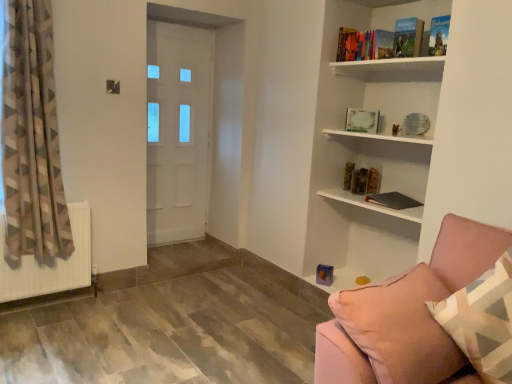
Question: Does hardcover book at upper right, the first book when ordered from bottom to top, have a larger size compared to hardcover book at upper right, which appears as the fifth book when ordered from the bottom?

Choices:
 (A) yes
 (B) no

Answer: (A)

Question: Does hardcover book at upper right, the first book when ordered from bottom to top, have a lesser height compared to hardcover book at upper right, which appears as the fifth book when ordered from the bottom?

Choices:
 (A) yes
 (B) no

Answer: (A)

Question: From the image's perspective, is hardcover book at upper right, the sixth book positioned from the top, located above hardcover book at upper right, which appears as the fifth book when ordered from the bottom?

Choices:
 (A) yes
 (B) no

Answer: (B)

Question: From a real-world perspective, is hardcover book at upper right, the first book when ordered from bottom to top, beneath hardcover book at upper right, which appears as the fifth book when ordered from the bottom?

Choices:
 (A) no
 (B) yes

Answer: (B)

Question: Is hardcover book at upper right, the first book when ordered from bottom to top, oriented towards hardcover book at upper right, which ranks as the 2th book in top-to-bottom order?

Choices:
 (A) yes
 (B) no

Answer: (B)

Question: Considering the positions of white matte frame at upper center, which is the 4th book from top to bottom, and white glossy door at center in the image, is white matte frame at upper center, which is the 4th book from top to bottom, taller or shorter than white glossy door at center?

Choices:
 (A) short
 (B) tall

Answer: (A)

Question: Considering their positions, is white matte frame at upper center, acting as the third book starting from the bottom, located in front of or behind white glossy door at center?

Choices:
 (A) behind
 (B) front

Answer: (B)

Question: From a real-world perspective, is white matte frame at upper center, acting as the third book starting from the bottom, above or below white glossy door at center?

Choices:
 (A) above
 (B) below

Answer: (A)

Question: Considering the positions of white matte frame at upper center, which is the 4th book from top to bottom, and white glossy door at center in the image, is white matte frame at upper center, which is the 4th book from top to bottom, wider or thinner than white glossy door at center?

Choices:
 (A) wide
 (B) thin

Answer: (B)

Question: From a real-world perspective, is white matte radiator at lower left above or below matte black book at center?

Choices:
 (A) below
 (B) above

Answer: (A)

Question: Looking at the image, does white matte radiator at lower left seem bigger or smaller compared to matte black book at center?

Choices:
 (A) small
 (B) big

Answer: (B)

Question: From the image's perspective, is white matte radiator at lower left located above or below matte black book at center?

Choices:
 (A) above
 (B) below

Answer: (B)

Question: Does point (86, 236) appear closer or farther from the camera than point (347, 193)?

Choices:
 (A) farther
 (B) closer

Answer: (B)

Question: In the image, is pink fabric couch at lower right on the left side or the right side of white matte radiator at lower left?

Choices:
 (A) left
 (B) right

Answer: (B)

Question: From the image's perspective, relative to white matte radiator at lower left, is pink fabric couch at lower right above or below?

Choices:
 (A) above
 (B) below

Answer: (B)